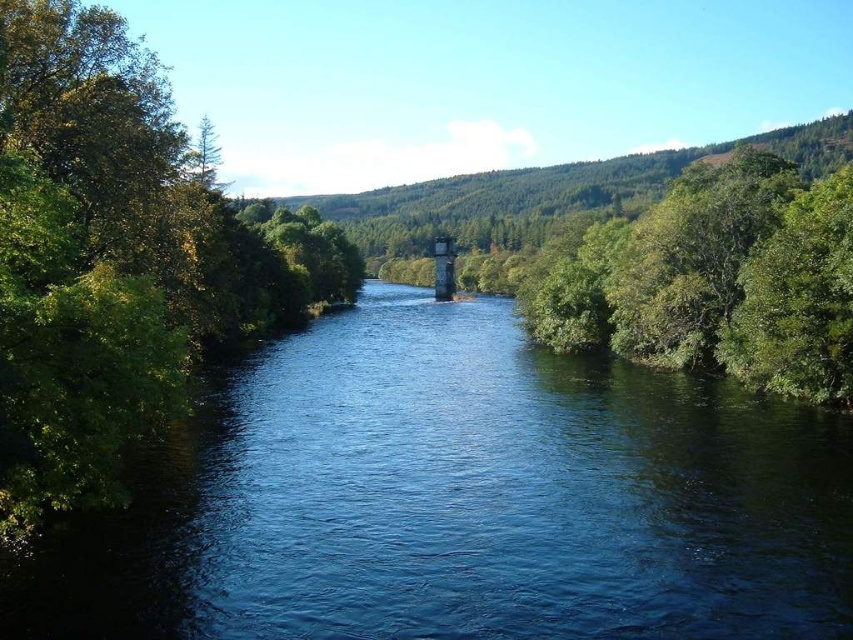
You are standing at the center of the image and want to reach the blue smooth water at center. Which direction should you move to get there?

Since you are already at the center of the image, you are already at the blue smooth water at center.